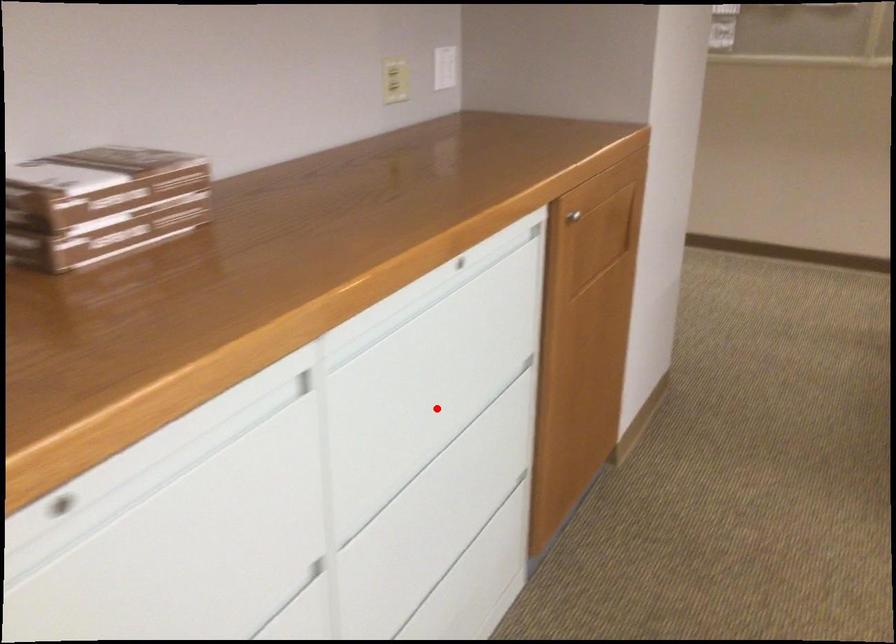
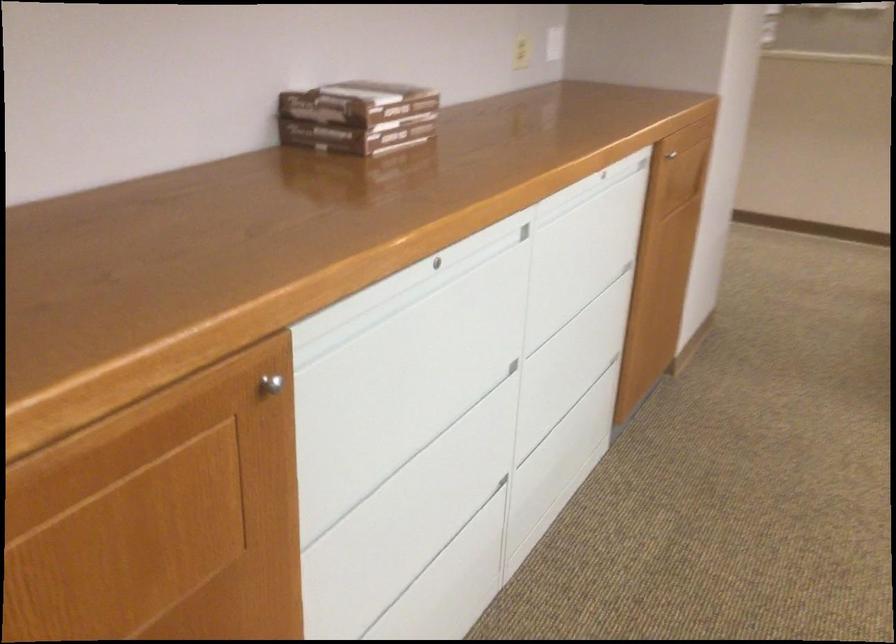
Question: I am providing you with two images of the same scene from different viewpoints. A red point is marked on the first image. Can you still see the location of the red point in image 2?

Choices:
 (A) Yes
 (B) No

Answer: (A)